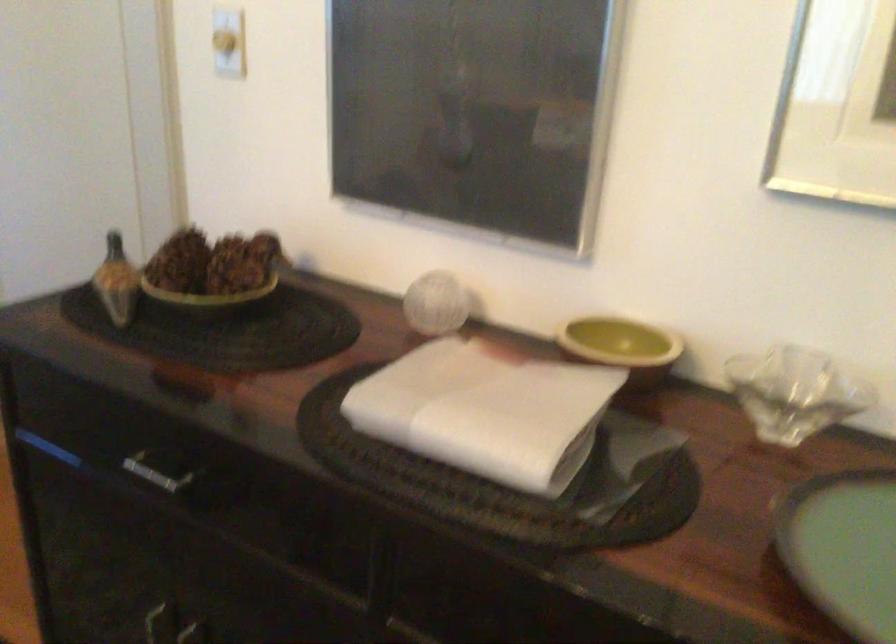
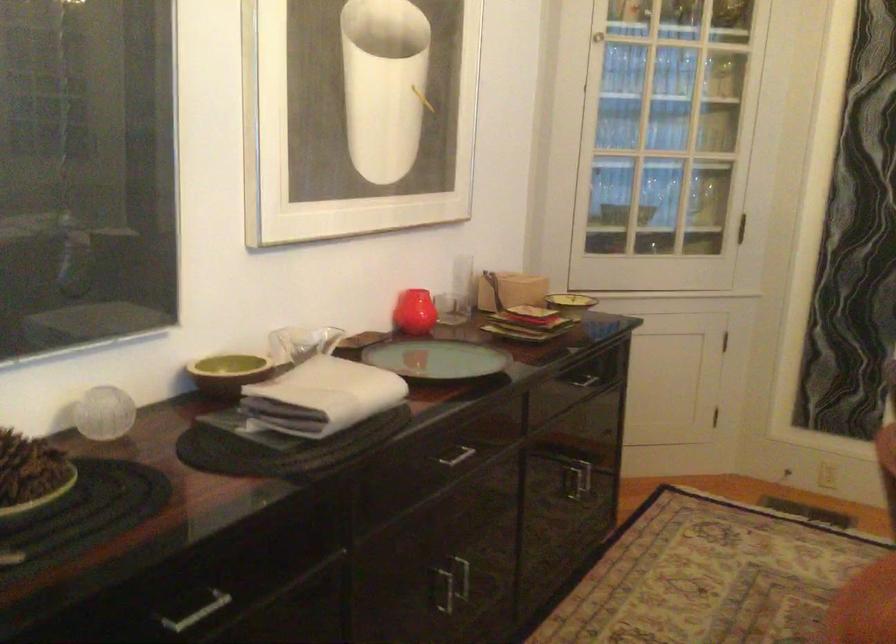
The point at (x=567, y=305) is marked in the first image. Where is the corresponding point in the second image?

(228, 373)